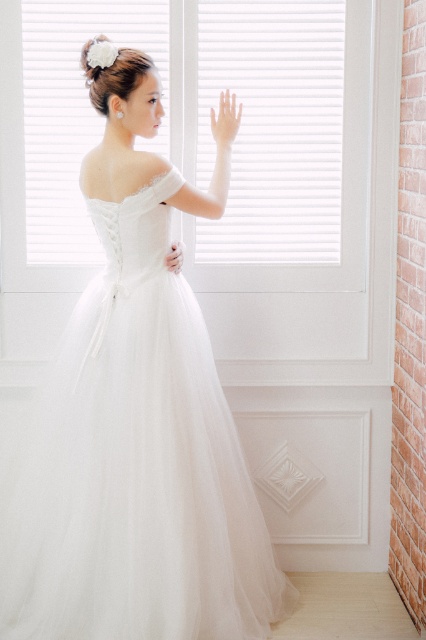
Question: Which object appears farthest from the camera in this image?

Choices:
 (A) transparent skin at upper center
 (B) white satin hand at center
 (C) white tulle dress at center
 (D) white matte window at center

Answer: (D)

Question: Is white matte window at center smaller than white satin hand at center?

Choices:
 (A) no
 (B) yes

Answer: (A)

Question: Among these objects, which one is farthest from the camera?

Choices:
 (A) white matte window at center
 (B) white tulle dress at center

Answer: (A)

Question: Which is farther from the white tulle dress at center?

Choices:
 (A) transparent skin at upper center
 (B) white matte window at center

Answer: (A)

Question: Can you confirm if white tulle dress at center is positioned to the left of transparent skin at upper center?

Choices:
 (A) yes
 (B) no

Answer: (A)

Question: Is transparent skin at upper center further to camera compared to white satin hand at center?

Choices:
 (A) yes
 (B) no

Answer: (A)